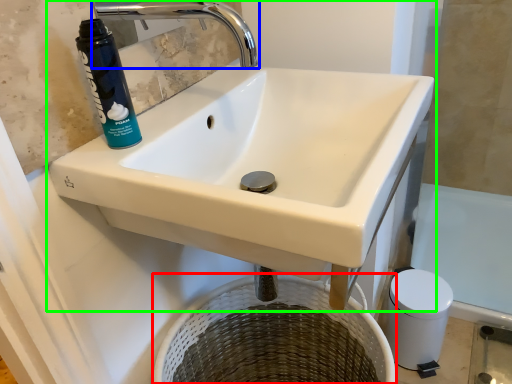
Question: Which is farther away from basket (highlighted by a red box)? tap (highlighted by a blue box) or sink (highlighted by a green box)?

Choices:
 (A) tap
 (B) sink

Answer: (A)